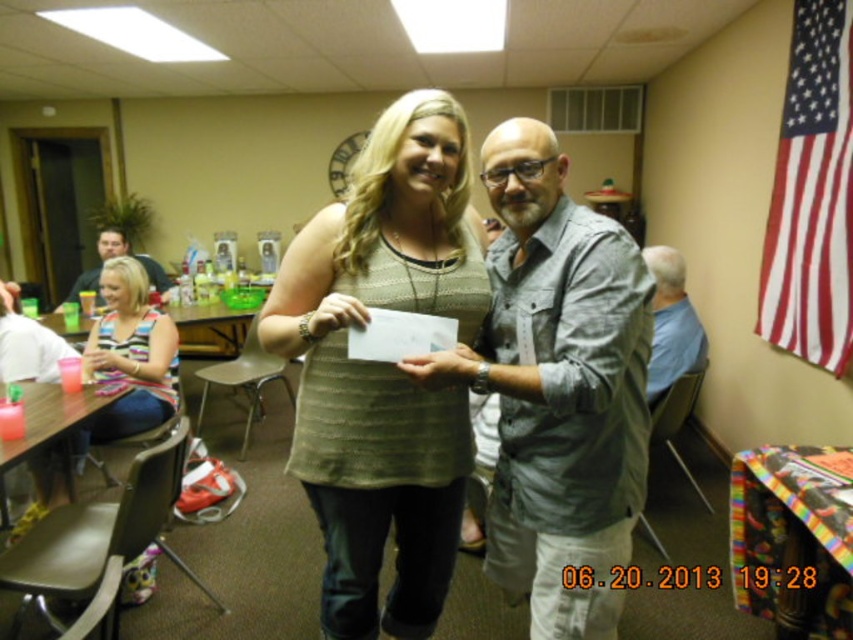
You are standing at point (107, 246) and want to walk to point (561, 323). Is the path between these two points clear of obstacles?

Point (561, 323) is in front of point (107, 246), so the path between them is clear of obstacles.

Consider the image. You are organizing a clothing donation drive and need to stack items vertically. If you have a green knitted sweater at center and a blue cotton shirt at right, which item should you place on top to ensure proper stacking based on their positions in the image?

The blue cotton shirt at right should be placed on top since the green knitted sweater at center is located below it in the image, indicating it is lower in the vertical stacking order.